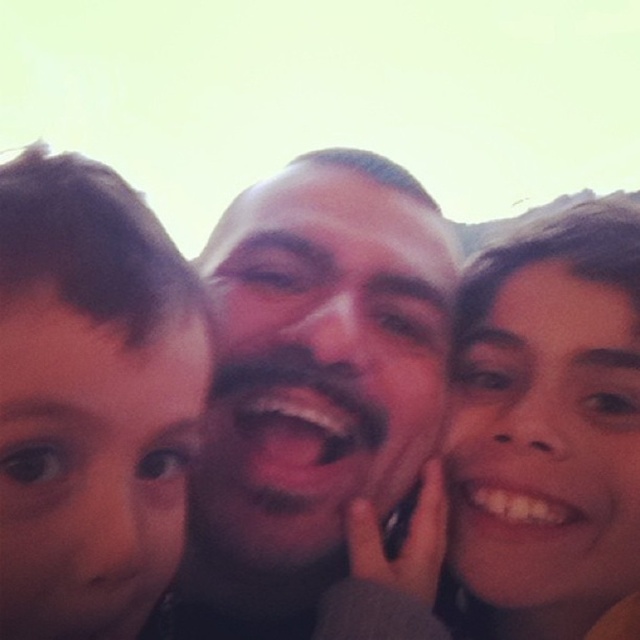
Question: Which of the following is the farthest from the observer?

Choices:
 (A) smooth skin at center
 (B) brown hair at left
 (C) smooth skin face at center

Answer: (C)

Question: Is smooth skin face at center smaller than smooth skin at center?

Choices:
 (A) yes
 (B) no

Answer: (A)

Question: Which point is farther to the camera?

Choices:
 (A) smooth skin at center
 (B) brown hair at left
 (C) smooth skin face at center

Answer: (C)

Question: Can you confirm if smooth skin at center is thinner than brown hair at left?

Choices:
 (A) no
 (B) yes

Answer: (A)

Question: Where is smooth skin face at center located in relation to brown hair at left in the image?

Choices:
 (A) below
 (B) above

Answer: (A)

Question: Which of the following is the farthest from the observer?

Choices:
 (A) smooth skin face at center
 (B) brown hair at left
 (C) smooth skin at center

Answer: (A)